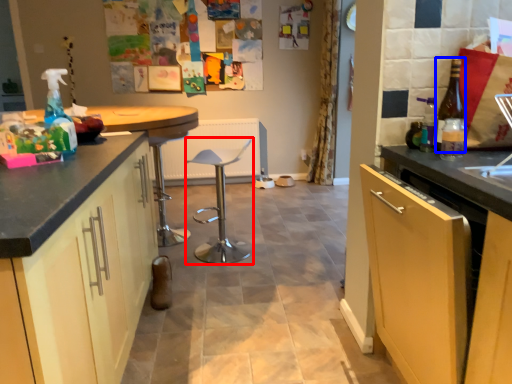
Question: Which object is closer to the camera taking this photo, bar stool (highlighted by a red box) or bottle (highlighted by a blue box)?

Choices:
 (A) bar stool
 (B) bottle

Answer: (B)